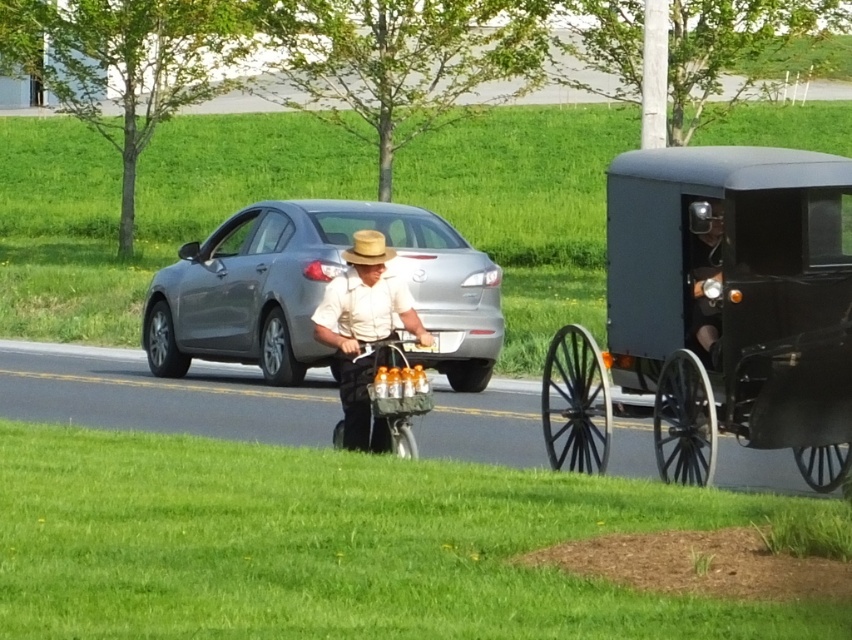
Question: Does silver metallic sedan at center have a greater width compared to light beige cotton shirt at center?

Choices:
 (A) yes
 (B) no

Answer: (A)

Question: Which point is farther to the camera?

Choices:
 (A) matte black buggy at right
 (B) silver metallic sedan at center

Answer: (B)

Question: Which of the following is the closest to the observer?

Choices:
 (A) silver metallic sedan at center
 (B) black wood wagon at right

Answer: (B)

Question: Observing the image, what is the correct spatial positioning of silver metallic sedan at center in reference to light brown straw cowboy hat at center?

Choices:
 (A) below
 (B) above

Answer: (B)

Question: Does matte black buggy at right have a smaller size compared to light brown straw cowboy hat at center?

Choices:
 (A) yes
 (B) no

Answer: (B)

Question: Based on their relative distances, which object is farther from the light brown straw cowboy hat at center?

Choices:
 (A) black wood wagon at right
 (B) matte black buggy at right
 (C) metallic silver bicycle at center
 (D) silver metallic sedan at center

Answer: (D)